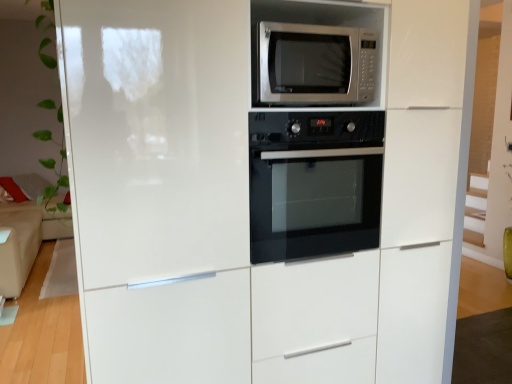
Question: Is beige fabric couch at left at the back of black glass oven at center?

Choices:
 (A) no
 (B) yes

Answer: (B)

Question: Can you confirm if black glass oven at center is positioned to the left of beige fabric couch at left?

Choices:
 (A) yes
 (B) no

Answer: (B)

Question: Considering the relative sizes of black glass oven at center and beige fabric couch at left in the image provided, is black glass oven at center smaller than beige fabric couch at left?

Choices:
 (A) no
 (B) yes

Answer: (B)

Question: Is black glass oven at center positioned beyond the bounds of beige fabric couch at left?

Choices:
 (A) no
 (B) yes

Answer: (B)

Question: From the image's perspective, is black glass oven at center above beige fabric couch at left?

Choices:
 (A) yes
 (B) no

Answer: (A)

Question: Is black glass oven at center wider than beige fabric couch at left?

Choices:
 (A) no
 (B) yes

Answer: (A)

Question: Can you confirm if beige fabric couch at left is positioned to the left of black glass oven at center?

Choices:
 (A) no
 (B) yes

Answer: (B)

Question: Can you confirm if beige fabric couch at left is positioned to the right of black glass oven at center?

Choices:
 (A) yes
 (B) no

Answer: (B)

Question: From the image's perspective, is beige fabric couch at left over black glass oven at center?

Choices:
 (A) no
 (B) yes

Answer: (A)

Question: From the image's perspective, is beige fabric couch at left under black glass oven at center?

Choices:
 (A) no
 (B) yes

Answer: (B)

Question: Could black glass oven at center be considered to be inside beige fabric couch at left?

Choices:
 (A) yes
 (B) no

Answer: (B)

Question: Does beige fabric couch at left have a greater width compared to black glass oven at center?

Choices:
 (A) no
 (B) yes

Answer: (B)

Question: From a real-world perspective, is beige fabric couch at left beneath satin silver microwave at upper center?

Choices:
 (A) yes
 (B) no

Answer: (A)